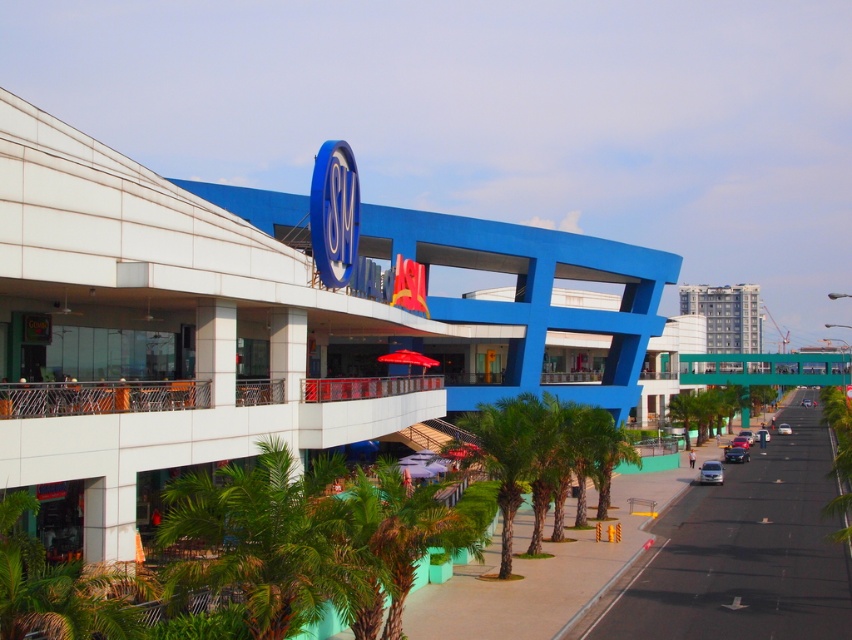
Question: Can you confirm if silver metallic sedan at center-right is thinner than silver metallic sedan at center?

Choices:
 (A) no
 (B) yes

Answer: (B)

Question: Does gray concrete building at upper right lie behind metallic silver sedan at center-right?

Choices:
 (A) no
 (B) yes

Answer: (B)

Question: Which object is the closest to the silver metallic sedan at center-right?

Choices:
 (A) silver metallic sedan at center
 (B) green leafy palm tree at center

Answer: (B)

Question: Is blue glossy building at center above green leafy palm tree at center?

Choices:
 (A) no
 (B) yes

Answer: (B)

Question: Which point is closer to the camera?

Choices:
 (A) (174, 422)
 (B) (499, 508)

Answer: (A)

Question: Which of the following is the farthest from the observer?

Choices:
 (A) (734, 326)
 (B) (741, 458)
 (C) (700, 483)

Answer: (A)